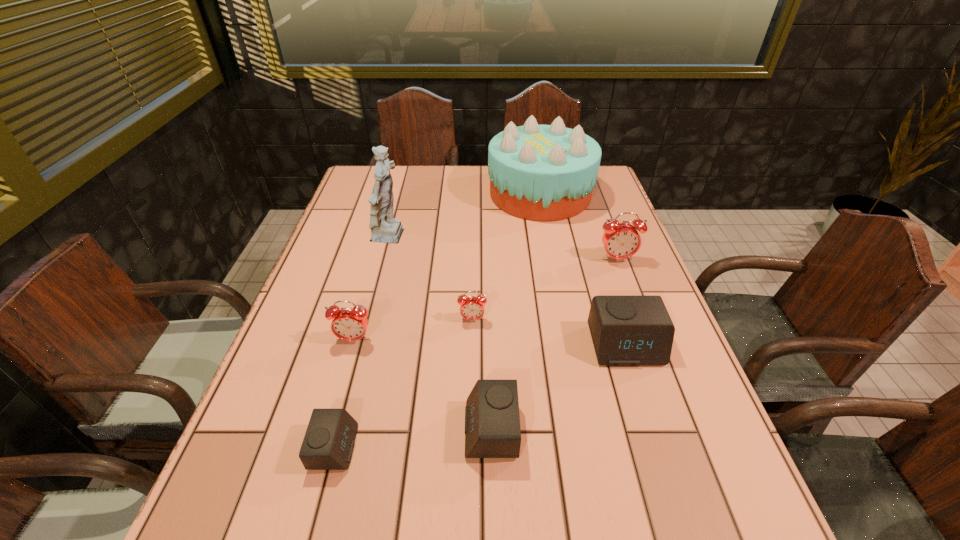
Locate an element on the screen. vacant point located 0.300m on the face of the fifth nearest alarm clock is located at coordinates (470, 447).

You are a GUI agent. You are given a task and a screenshot of the screen. Output one action in this format:
    pyautogui.click(x=<x>, y=<y>)
    Task: Click on the vacant region located 0.250m on the front-facing side of the second black alarm clock from right to left
    This screenshot has height=540, width=960.
    Given the screenshot: What is the action you would take?
    pyautogui.click(x=330, y=430)

Locate an element on the screen. The height and width of the screenshot is (540, 960). free space located on the front-facing side of the second black alarm clock from right to left is located at coordinates (314, 430).

Identify the location of vacant space positioned 0.090m on the front-facing side of the second black alarm clock from right to left. The height and width of the screenshot is (540, 960). (417, 430).

At what (x,y) coordinates should I click in order to perform the action: click on blank space located on the front-facing side of the shortest object. Please return your answer as a coordinate pair (x, y). This screenshot has height=540, width=960. Looking at the image, I should click on (394, 447).

Image resolution: width=960 pixels, height=540 pixels. Identify the location of object situated at the far edge. (537, 172).

Image resolution: width=960 pixels, height=540 pixels. I want to click on figurine present at the left edge, so click(x=386, y=229).

At what (x,y) coordinates should I click in order to perform the action: click on cake located in the right edge section of the desktop. Please return your answer as a coordinate pair (x, y). Looking at the image, I should click on (537, 172).

The width and height of the screenshot is (960, 540). In order to click on object that is positioned at the far right corner in this screenshot , I will do `click(537, 172)`.

Locate an element on the screen. blank space at the left edge of the desktop is located at coordinates (228, 477).